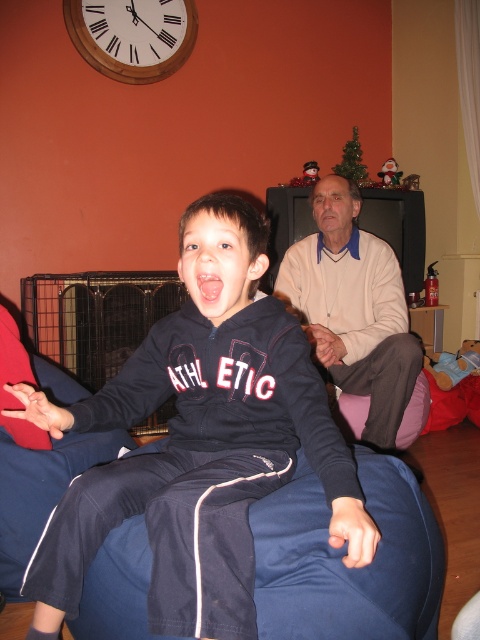
Describe the element at coordinates (354, 308) in the screenshot. I see `light beige sweater at center` at that location.

Who is lower down, light beige sweater at center or wooden clock at upper left?

light beige sweater at center is lower down.

Is point (297, 285) in front of point (149, 54)?

Yes, it is in front of point (149, 54).

Identify the location of light beige sweater at center. This screenshot has width=480, height=640. (354, 308).

Can you confirm if dark blue athletic tracksuit at center is taller than light beige sweater at center?

No, dark blue athletic tracksuit at center is not taller than light beige sweater at center.

Does dark blue athletic tracksuit at center have a smaller size compared to light beige sweater at center?

Yes, dark blue athletic tracksuit at center is smaller than light beige sweater at center.

This screenshot has width=480, height=640. In order to click on dark blue athletic tracksuit at center in this screenshot , I will do `click(199, 442)`.

Between dark blue athletic tracksuit at center and wooden clock at upper left, which one has more height?

dark blue athletic tracksuit at center is taller.

Can you confirm if dark blue athletic tracksuit at center is smaller than wooden clock at upper left?

No, dark blue athletic tracksuit at center is not smaller than wooden clock at upper left.

The height and width of the screenshot is (640, 480). In order to click on dark blue athletic tracksuit at center in this screenshot , I will do point(199,442).